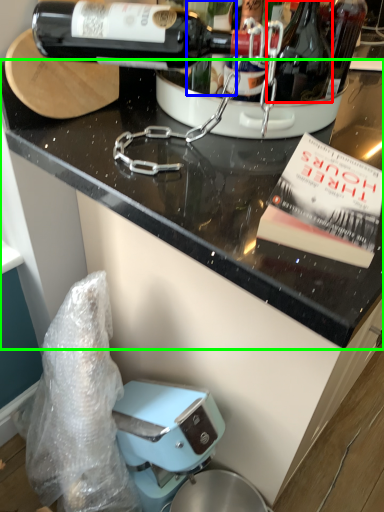
Question: Which object is positioned closest to bottle (highlighted by a red box)? Select from wine (highlighted by a blue box) and countertop (highlighted by a green box).

Choices:
 (A) wine
 (B) countertop

Answer: (A)